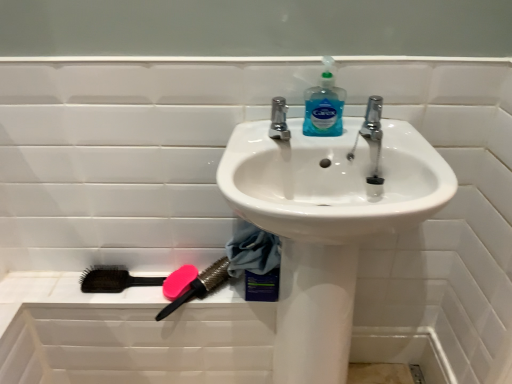
This screenshot has height=384, width=512. I want to click on free spot to the right of chrome metallic faucet at upper center, so click(352, 134).